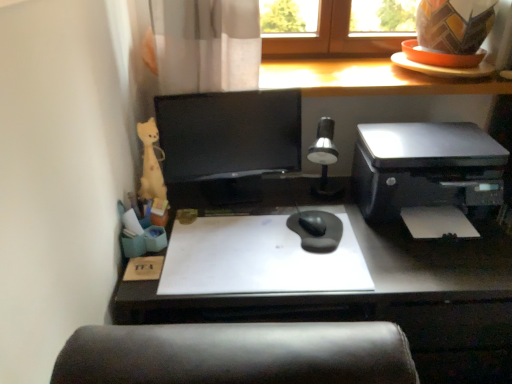
Where is `satin black printer at right`? satin black printer at right is located at coordinates (428, 176).

What are the coordinates of `matte black desk at center` in the screenshot? It's located at (385, 301).

The height and width of the screenshot is (384, 512). I want to click on yellow plush toy at left, so click(151, 163).

The height and width of the screenshot is (384, 512). In order to click on matte wood counter top at upper center in this screenshot , I will do `click(367, 79)`.

This screenshot has width=512, height=384. Find the location of `satin black printer at right`. satin black printer at right is located at coordinates (428, 176).

Between black glossy monitor at center and yellow plush toy at left, which one appears on the right side from the viewer's perspective?

black glossy monitor at center.

Considering the relative sizes of black glossy monitor at center and yellow plush toy at left in the image provided, is black glossy monitor at center bigger than yellow plush toy at left?

Indeed, black glossy monitor at center has a larger size compared to yellow plush toy at left.

From a real-world perspective, between black glossy monitor at center and yellow plush toy at left, who is vertically higher?

From a 3D spatial view, black glossy monitor at center is above.

Where is `printer that appears on the right of matte black desk at center`? The height and width of the screenshot is (384, 512). printer that appears on the right of matte black desk at center is located at coordinates pos(428,176).

Between matte black desk at center and satin black printer at right, which one has smaller width?

Thinner between the two is matte black desk at center.

Is matte black desk at center next to satin black printer at right?

matte black desk at center is not next to satin black printer at right, and they're not touching.

Considering the sizes of objects black glossy monitor at center and matte black desk at center in the image provided, who is smaller, black glossy monitor at center or matte black desk at center?

black glossy monitor at center.

In terms of height, does black glossy monitor at center look taller or shorter compared to matte black desk at center?

Considering their sizes, black glossy monitor at center has less height than matte black desk at center.

Which object is wider, black glossy monitor at center or matte black desk at center?

With larger width is matte black desk at center.

Between black glossy monitor at center and matte black desk at center, which one appears on the left side from the viewer's perspective?

Positioned to the left is black glossy monitor at center.

Which of these two, white paper at right or silver metallic table lamp at center, is thinner?

silver metallic table lamp at center is thinner.

Considering their positions, is white paper at right located in front of or behind silver metallic table lamp at center?

Clearly, white paper at right is in front of silver metallic table lamp at center.

Considering the sizes of objects white paper at right and silver metallic table lamp at center in the image provided, who is shorter, white paper at right or silver metallic table lamp at center?

With less height is white paper at right.

From the image's perspective, who appears lower, white paper at right or silver metallic table lamp at center?

From the image's view, white paper at right is below.

Does black glossy monitor at center have a lesser width compared to satin black printer at right?

Yes.

Is black glossy monitor at center bigger than satin black printer at right?

Actually, black glossy monitor at center might be smaller than satin black printer at right.

Does black glossy monitor at center turn towards satin black printer at right?

No.

Is white paper at right in front of or behind matte black desk at center in the image?

white paper at right is behind matte black desk at center.

Which of these two, white paper at right or matte black desk at center, is bigger?

matte black desk at center is bigger.

From a real-world perspective, is white paper at right under matte black desk at center?

Actually, white paper at right is physically above matte black desk at center in the real world.

Is matte black desk at center surrounded by white paper at right?

No, matte black desk at center is not a part of white paper at right.

You are a GUI agent. You are given a task and a screenshot of the screen. Output one action in this format:
    pyautogui.click(x=<x>, y=<y>)
    Task: Click on the stationery in front of the matte wood counter top at upper center
    The image size is (512, 384).
    Given the screenshot: What is the action you would take?
    pyautogui.click(x=151, y=163)

Can you confirm if matte wood counter top at upper center is smaller than yellow plush toy at left?

No.

Consider the image. From a real-world perspective, is matte wood counter top at upper center positioned over yellow plush toy at left based on gravity?

Yes, from a real-world perspective, matte wood counter top at upper center is on top of yellow plush toy at left.

I want to click on stationery directly beneath the black glossy monitor at center (from a real-world perspective), so click(151, 163).

Identify the location of printer that is above the matte black desk at center (from a real-world perspective). (428, 176).

When comparing their distances from black glossy monitor at center, does matte wood counter top at upper center or yellow plush toy at left seem closer?

yellow plush toy at left is positioned closer to the anchor black glossy monitor at center.

Considering their positions, is silver metallic table lamp at center positioned closer to yellow plush toy at left than matte wood counter top at upper center?

silver metallic table lamp at center lies closer to yellow plush toy at left than the other object.

Looking at the image, which one is located closer to silver metallic table lamp at center, satin black printer at right or black glossy monitor at center?

satin black printer at right.

Considering their positions, is matte wood counter top at upper center positioned closer to yellow plush toy at left than satin black printer at right?

Among the two, matte wood counter top at upper center is located nearer to yellow plush toy at left.

Based on their spatial positions, is yellow plush toy at left or satin black printer at right further from matte wood counter top at upper center?

yellow plush toy at left is positioned further to the anchor matte wood counter top at upper center.

When comparing their distances from silver metallic table lamp at center, does white paper at right or yellow plush toy at left seem further?

Based on the image, yellow plush toy at left appears to be further to silver metallic table lamp at center.

From the image, which object appears to be farther from yellow plush toy at left, matte wood counter top at upper center or black glossy monitor at center?

Based on the image, matte wood counter top at upper center appears to be further to yellow plush toy at left.

When comparing their distances from white paper at right, does silver metallic table lamp at center or black glossy monitor at center seem further?

The object further to white paper at right is black glossy monitor at center.

Where is `table lamp between matte wood counter top at upper center and white paper at right in the vertical direction`? table lamp between matte wood counter top at upper center and white paper at right in the vertical direction is located at coordinates (325, 159).

Where is `counter top situated between yellow plush toy at left and white paper at right from left to right`? counter top situated between yellow plush toy at left and white paper at right from left to right is located at coordinates (367, 79).

Where is `computer monitor located between matte black desk at center and matte wood counter top at upper center in the depth direction`? This screenshot has height=384, width=512. computer monitor located between matte black desk at center and matte wood counter top at upper center in the depth direction is located at coordinates (226, 144).

Locate an element on the screen. The image size is (512, 384). notepad between yellow plush toy at left and satin black printer at right from left to right is located at coordinates (437, 222).